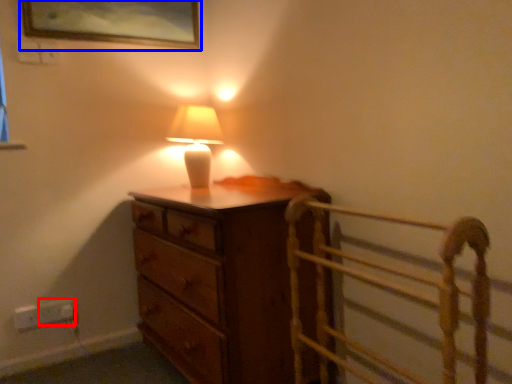
Question: Which of the following is the closest to the observer, electric outlet (highlighted by a red box) or picture frame (highlighted by a blue box)?

Choices:
 (A) electric outlet
 (B) picture frame

Answer: (B)